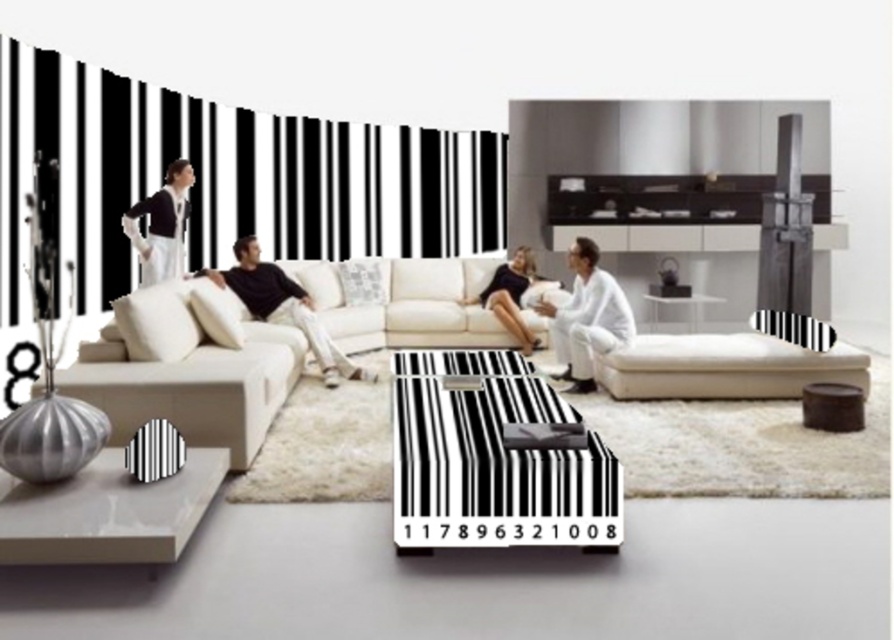
You are a delivery person carrying a package that requires a flat surface to place. The package is 1.5 meters long. You see the black glossy coffee table at center and the white matte couch at center. Can you place the package on either of them?

The black glossy coffee table at center is 1.48 meters away from the white matte couch at center. Since the package is 1.5 meters long, it cannot be placed on either surface because the distance between them is shorter than the package length.

You are planning to place a new sofa in your living room and want to compare it with the existing beige fabric sofa at center and the matte black dress at upper left. Which object is wider?

The beige fabric sofa at center is wider than the matte black dress at upper left.

You are a guest entering the living room and want to sit on the white matte couch at center. Which side of the couch should you approach if you want to sit closest to the black glossy coffee table at center?

The black glossy coffee table at center is to the left of the white matte couch at center, so you should approach the left side of the couch to sit closest to the coffee table.